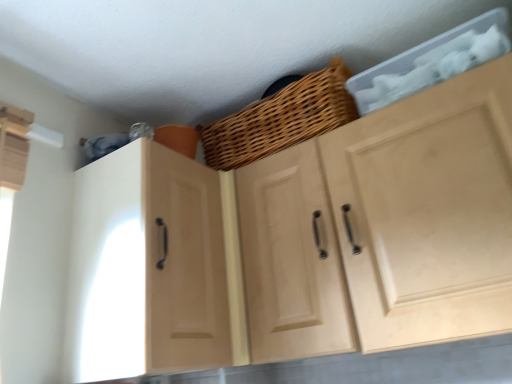
Question: Does woven wood basket at upper center appear on the left side of matte wood cabinet at left, positioned as the first cabinetry in left-to-right order?

Choices:
 (A) yes
 (B) no

Answer: (B)

Question: Is matte wood cabinet at left, the second cabinetry viewed from the right, completely or partially inside woven wood basket at upper center?

Choices:
 (A) no
 (B) yes

Answer: (A)

Question: Can you confirm if woven wood basket at upper center is thinner than matte wood cabinet at left, the second cabinetry viewed from the right?

Choices:
 (A) yes
 (B) no

Answer: (A)

Question: From a real-world perspective, is woven wood basket at upper center physically below matte wood cabinet at left, positioned as the first cabinetry in left-to-right order?

Choices:
 (A) yes
 (B) no

Answer: (B)

Question: Does woven wood basket at upper center have a smaller size compared to matte wood cabinet at left, positioned as the first cabinetry in left-to-right order?

Choices:
 (A) no
 (B) yes

Answer: (B)

Question: Is woven wood basket at upper center turned away from matte wood cabinet at left, positioned as the first cabinetry in left-to-right order?

Choices:
 (A) no
 (B) yes

Answer: (A)

Question: Is woven wood basket at upper center in front of natural wood cabinet at upper center, marked as the 1th cabinetry in a right-to-left arrangement?

Choices:
 (A) no
 (B) yes

Answer: (A)

Question: Considering the relative sizes of woven wood basket at upper center and natural wood cabinet at upper center, marked as the 1th cabinetry in a right-to-left arrangement, in the image provided, is woven wood basket at upper center smaller than natural wood cabinet at upper center, marked as the 1th cabinetry in a right-to-left arrangement,?

Choices:
 (A) no
 (B) yes

Answer: (B)

Question: Is woven wood basket at upper center behind natural wood cabinet at upper center, marked as the 1th cabinetry in a right-to-left arrangement?

Choices:
 (A) yes
 (B) no

Answer: (A)

Question: Is woven wood basket at upper center thinner than natural wood cabinet at upper center, the 2th cabinetry viewed from the left?

Choices:
 (A) yes
 (B) no

Answer: (A)

Question: From a real-world perspective, is woven wood basket at upper center physically above natural wood cabinet at upper center, the 2th cabinetry viewed from the left?

Choices:
 (A) yes
 (B) no

Answer: (A)

Question: Is woven wood basket at upper center next to natural wood cabinet at upper center, the 2th cabinetry viewed from the left, and touching it?

Choices:
 (A) yes
 (B) no

Answer: (B)

Question: From a real-world perspective, is natural wood cabinet at upper center, marked as the 1th cabinetry in a right-to-left arrangement, located beneath matte wood cabinet at left, the second cabinetry viewed from the right?

Choices:
 (A) no
 (B) yes

Answer: (B)